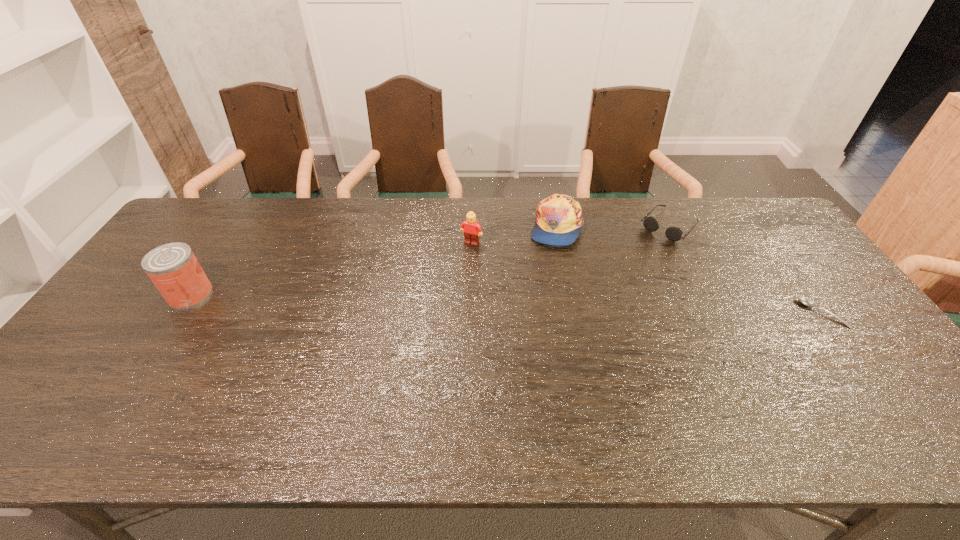
Find the location of `the leftmost object`. the leftmost object is located at coordinates (173, 268).

Locate an element on the screen. This screenshot has height=540, width=960. can is located at coordinates (173, 268).

I want to click on the rightmost object, so click(805, 301).

Locate an element on the screen. The image size is (960, 540). soupspoon is located at coordinates (805, 301).

Where is `the third shortest object`? This screenshot has height=540, width=960. the third shortest object is located at coordinates (559, 219).

Locate an element on the screen. This screenshot has height=540, width=960. the third object from left to right is located at coordinates (559, 219).

Identify the location of the fourth object from left to right. This screenshot has height=540, width=960. (674, 234).

Find the location of `sunglasses`. sunglasses is located at coordinates (674, 234).

Identify the location of Lego. (471, 229).

Find the location of a particular element. vacant area situated 0.290m on the front of the tallest object is located at coordinates (119, 404).